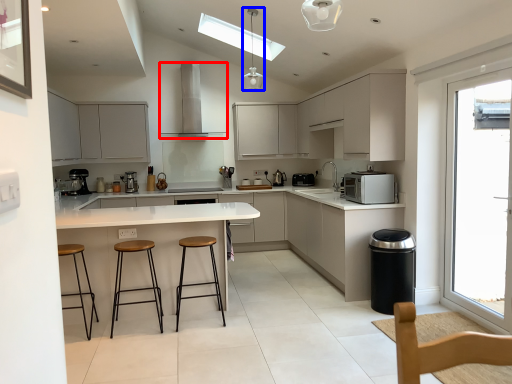
Question: Which of the following is the farthest to the observer, home appliance (highlighted by a red box) or light fixture (highlighted by a blue box)?

Choices:
 (A) home appliance
 (B) light fixture

Answer: (A)